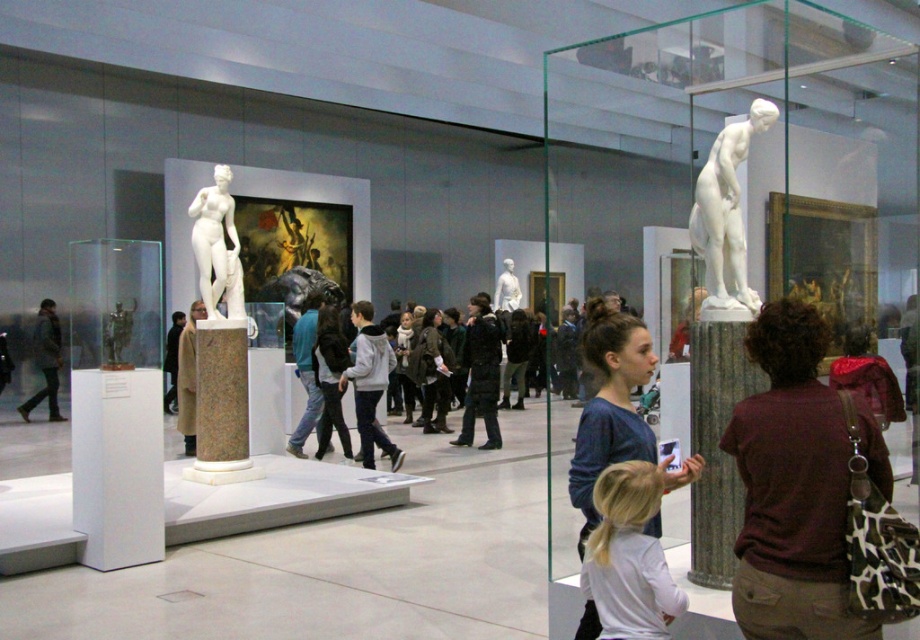
You are a visitor in the museum and want to take a photo of the white marble statue at upper right. The museum requires that all photos must be taken from the front of the statue. Given that the statue is at point 0.339, 0.790, where should you stand to ensure you are facing the front of the statue?

To take a photo from the front of the white marble statue at upper right, you should position yourself directly in front of it, which would be along the central axis of the statue. Since the statue is located at coordinates (726, 216), standing at a position slightly ahead of these coordinates while facing towards them would ensure you are capturing the front view.

You are an art curator planning to move the white marble statue at upper right and the dark gray jacket at left to a new exhibition space. Based on their sizes, which object requires more storage space?

The dark gray jacket at left requires more storage space because the white marble statue at upper right occupies less space than it.

You are a museum visitor carrying a large backpack. You need to pass between the green marble pillar at lower right and the dark gray jacket at left. Can you fit through the space between them?

The green marble pillar at lower right is narrower than the dark gray jacket at left, so the space between them may be sufficient for you to pass through with your backpack, but you should check the exact distance to ensure safety.